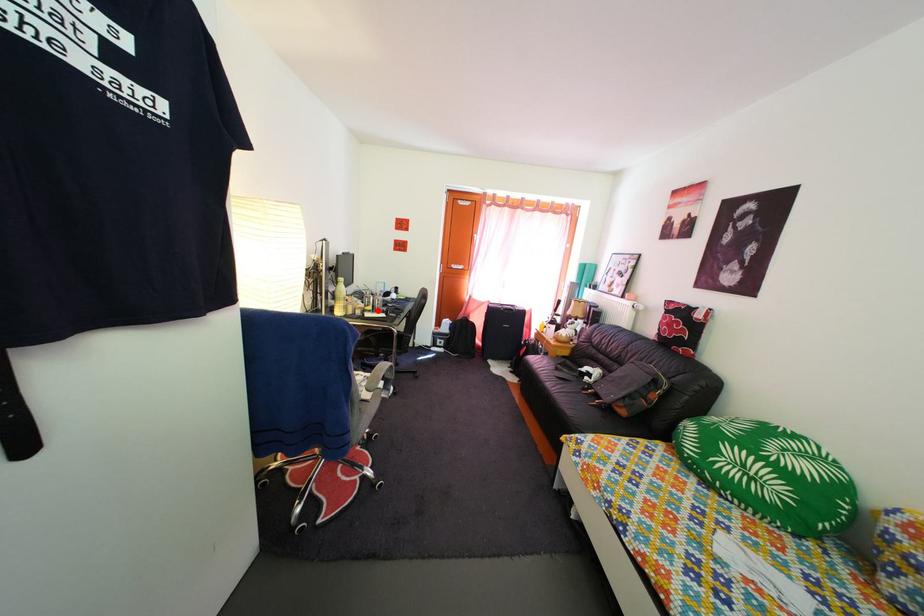
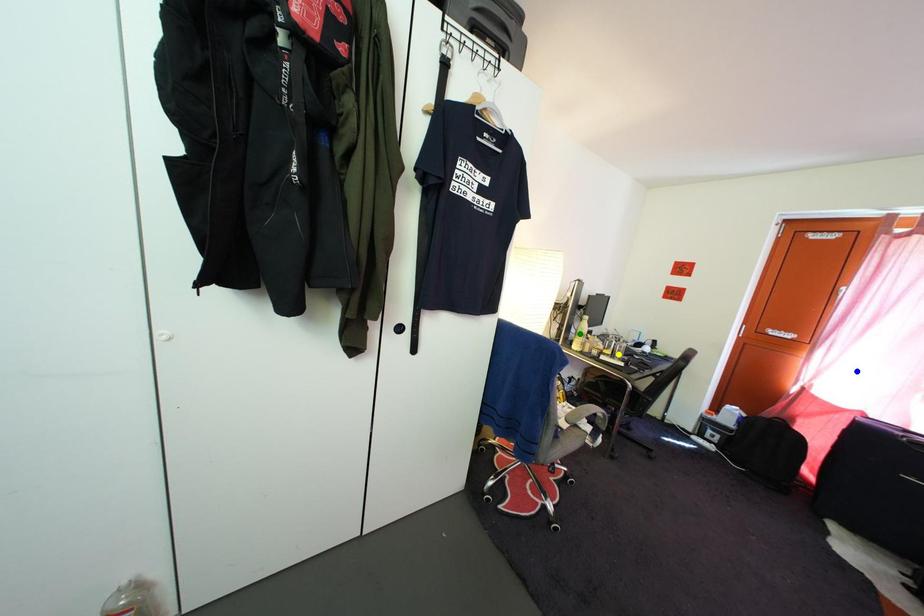
Question: I am providing you with two images of the same scene from different viewpoints. A red point is marked on the first image. You are given multiple points on the second image. Which point in image 2 is actually the same real-world point as the red point in image 1?

Choices:
 (A) green point
 (B) yellow point
 (C) blue point

Answer: (B)